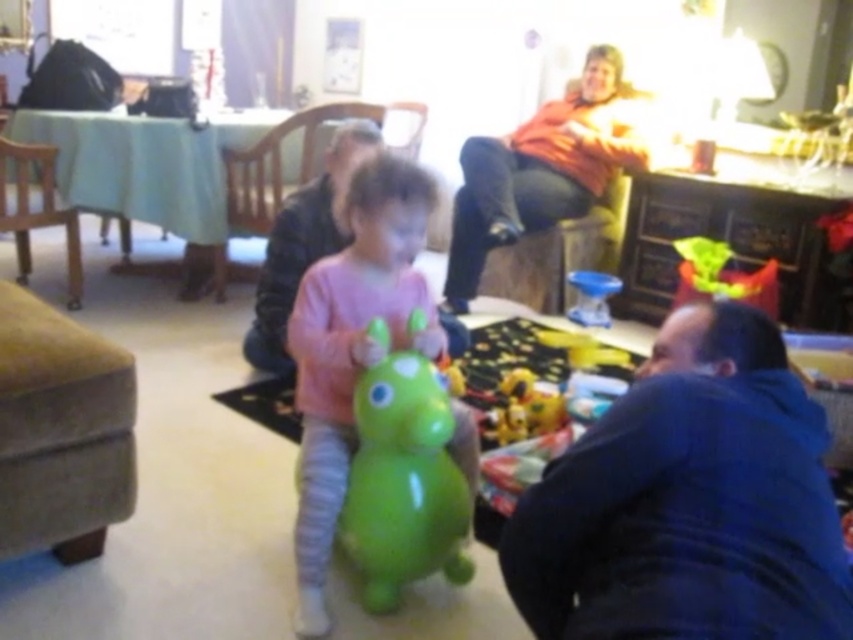
Can you confirm if green rubber toy at center is bigger than orange soft sweater at upper right?

No.

Who is positioned more to the right, green rubber toy at center or orange soft sweater at upper right?

orange soft sweater at upper right

Is point (422, 508) more distant than point (537, 179)?

No, (422, 508) is closer to viewer.

Locate an element on the screen. This screenshot has height=640, width=853. green rubber toy at center is located at coordinates (403, 481).

Is velvet beige armchair at left wider than green rubber toy at center?

Correct, the width of velvet beige armchair at left exceeds that of green rubber toy at center.

Which is more to the right, velvet beige armchair at left or green rubber toy at center?

From the viewer's perspective, green rubber toy at center appears more on the right side.

Locate an element on the screen. The width and height of the screenshot is (853, 640). velvet beige armchair at left is located at coordinates (61, 429).

Does blue cotton shirt at lower right appear over velvet beige armchair at left?

Incorrect, blue cotton shirt at lower right is not positioned above velvet beige armchair at left.

Between blue cotton shirt at lower right and velvet beige armchair at left, which one appears on the left side from the viewer's perspective?

Positioned to the left is velvet beige armchair at left.

Is point (718, 554) positioned after point (77, 340)?

No.

Identify the location of blue cotton shirt at lower right. (689, 500).